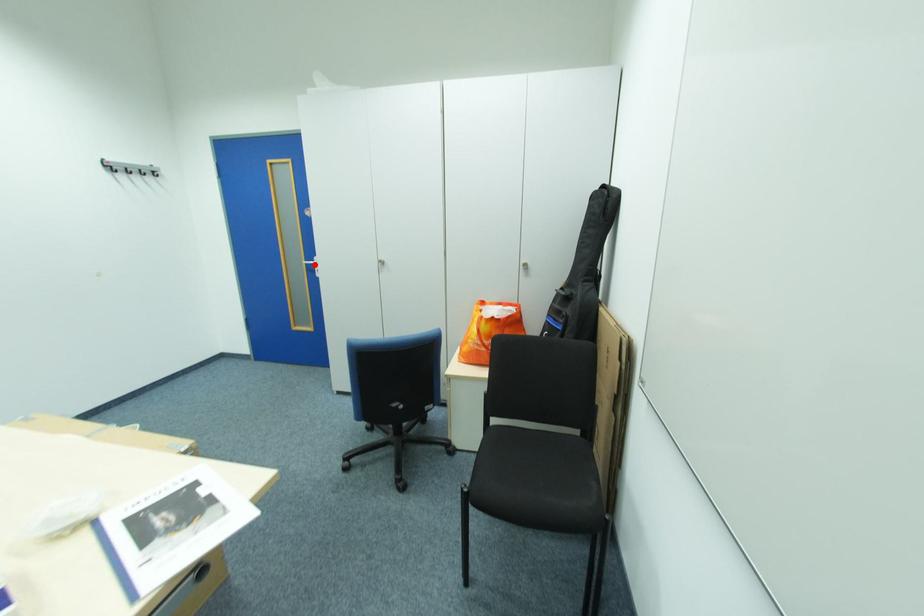
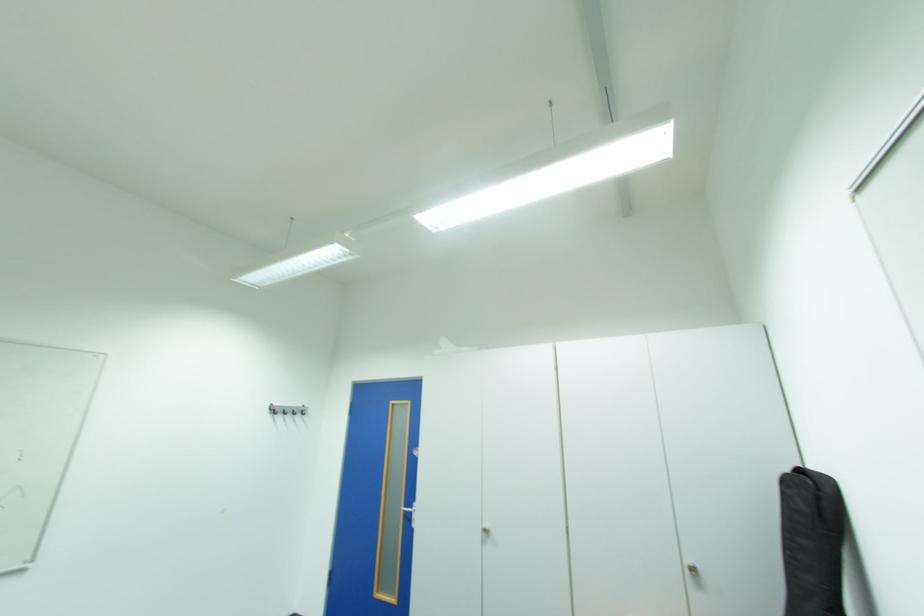
Find the pixel in the second image that matches the highlighted location in the first image.

(414, 511)